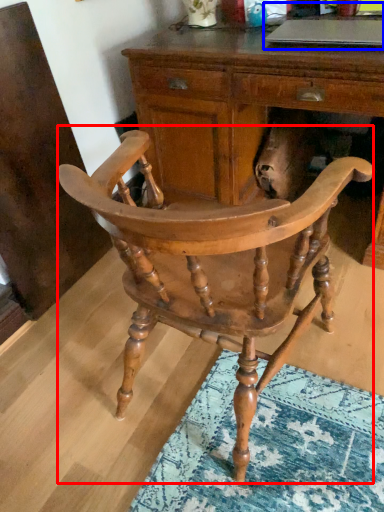
Question: Which of the following is the closest to the observer, chair (highlighted by a red box) or computer (highlighted by a blue box)?

Choices:
 (A) chair
 (B) computer

Answer: (A)